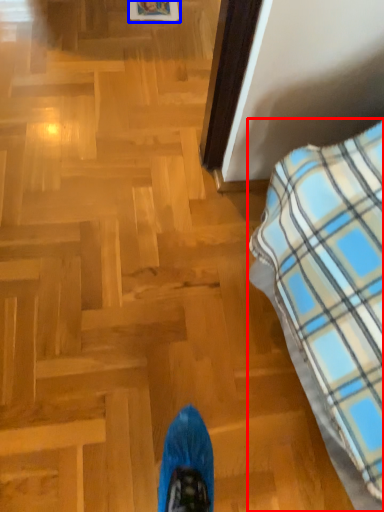
Question: Which of the following is the farthest to the observer, furniture (highlighted by a red box) or picture frame (highlighted by a blue box)?

Choices:
 (A) furniture
 (B) picture frame

Answer: (B)